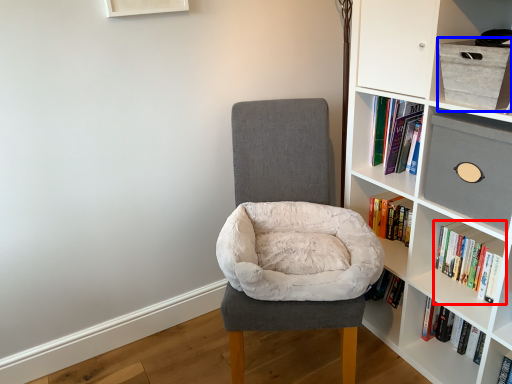
Question: Which of the following is the farthest to the observer, book (highlighted by a red box) or cabinet (highlighted by a blue box)?

Choices:
 (A) book
 (B) cabinet

Answer: (A)